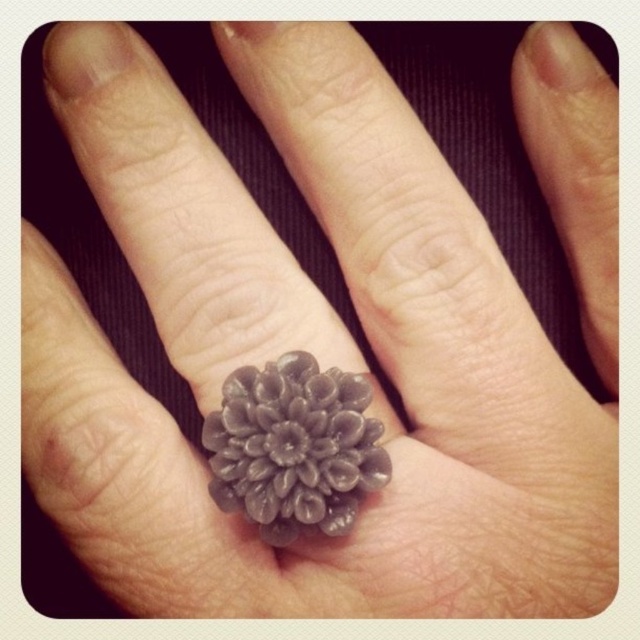
You are designing a display case for jewelry. You have two items to place inside the case. The satin gray ring at center and the matte gray petal at upper right. Based on their sizes, which item should be placed in the larger compartment?

The matte gray petal at upper right should be placed in the larger compartment because the satin gray ring at center occupies less space than matte gray petal at upper right.